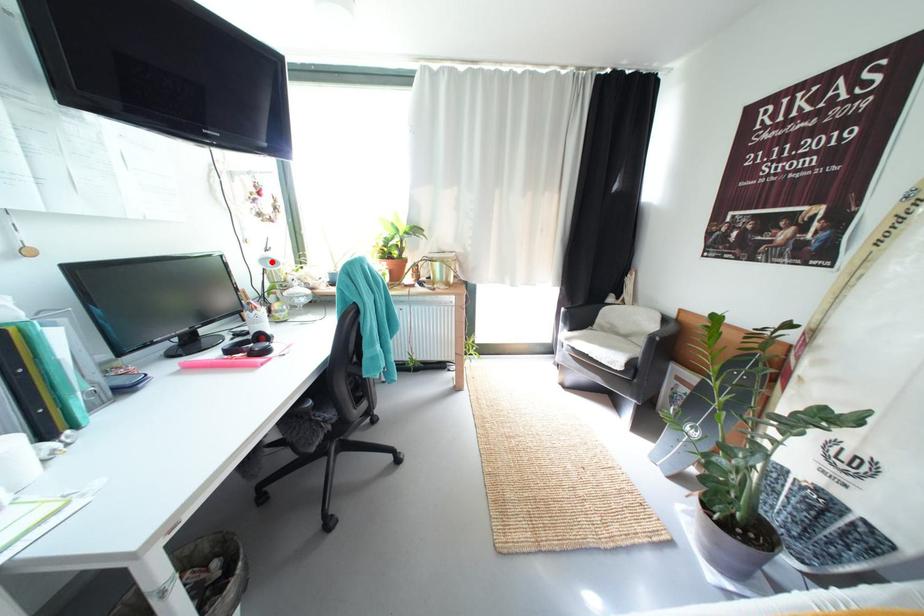
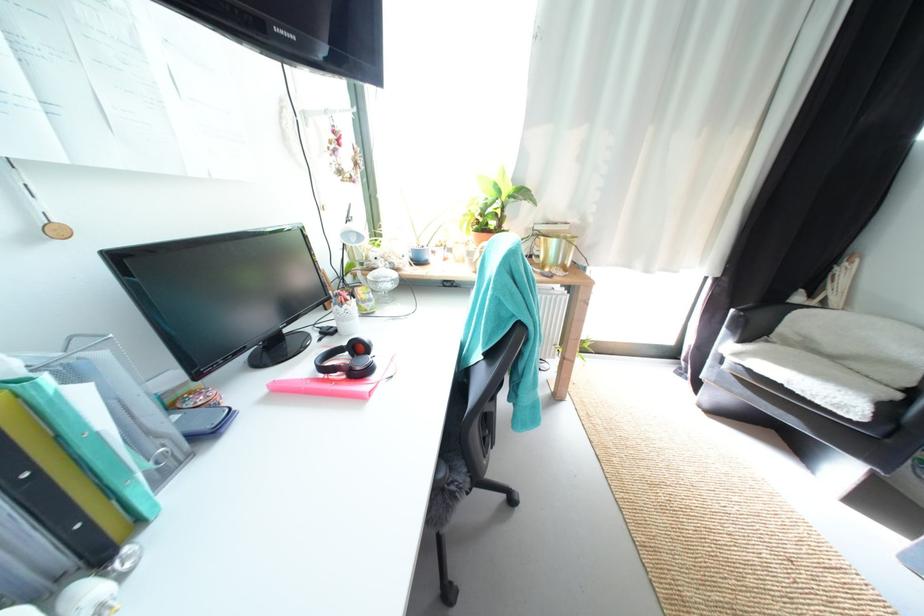
The point at the highlighted location is marked in the first image. Where is the corresponding point in the second image?

(354, 236)